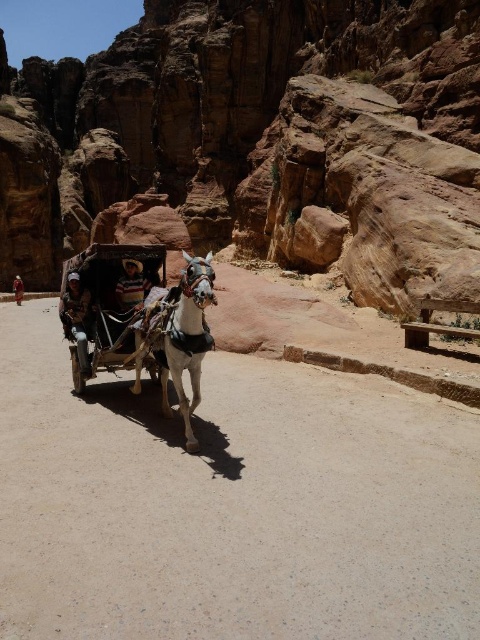
Is white glossy horse at center below striped shirt at center?

No.

Between white glossy horse at center and striped shirt at center, which one is positioned lower?

striped shirt at center is lower down.

The width and height of the screenshot is (480, 640). In order to click on white glossy horse at center in this screenshot , I will do `click(178, 336)`.

Can you confirm if striped shirt at center is wider than dark brown leather jacket at center?

No.

Between striped shirt at center and dark brown leather jacket at center, which one has less height?

With less height is striped shirt at center.

Which is behind, point (132, 307) or point (13, 282)?

The point (13, 282) is behind.

I want to click on striped shirt at center, so click(132, 285).

Locate an element on the screen. Image resolution: width=480 pixels, height=640 pixels. wooden cart at center is located at coordinates (108, 307).

Who is positioned more to the left, wooden cart at center or white glossy horse at center?

wooden cart at center is more to the left.

You are a GUI agent. You are given a task and a screenshot of the screen. Output one action in this format:
    pyautogui.click(x=<x>, y=<y>)
    Task: Click on the wooden cart at center
    The width and height of the screenshot is (480, 640).
    Given the screenshot: What is the action you would take?
    pyautogui.click(x=108, y=307)

The width and height of the screenshot is (480, 640). What are the coordinates of `wooden cart at center` in the screenshot? It's located at (108, 307).